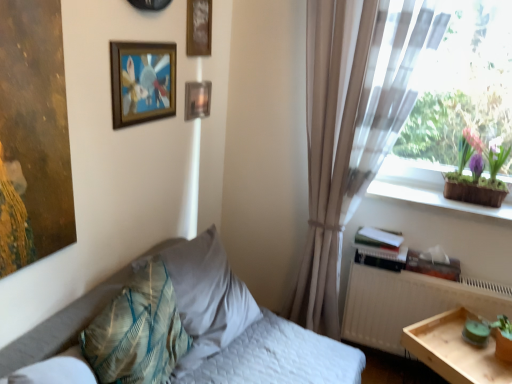
What do you see at coordinates (197, 99) in the screenshot?
I see `metallic rectangular frame at upper center, the first picture frame viewed from the back` at bounding box center [197, 99].

The image size is (512, 384). What do you see at coordinates (454, 350) in the screenshot?
I see `light wood tray at lower right` at bounding box center [454, 350].

Identify the location of wooden frame at upper left, which ranks as the first picture frame in front-to-back order. (142, 82).

What are the coordinates of `green wood window sill at upper right` in the screenshot? It's located at (435, 199).

What do you see at coordinates (199, 27) in the screenshot? The height and width of the screenshot is (384, 512). I see `wooden picture frame at upper center, which appears as the 2th picture frame when viewed from the back` at bounding box center [199, 27].

In order to face textured teal pillow at lower left, positioned as the 1th pillow in front-to-back order, should I rotate leftwards or rightwards?

Turn left by 14.832 degrees to look at textured teal pillow at lower left, positioned as the 1th pillow in front-to-back order.

Find the location of a particular element. metallic rectangular frame at upper center, the first picture frame viewed from the back is located at coordinates (197, 99).

Does textured beige pillow at center-left, arranged as the second pillow when viewed from the front, touch purple clay pot at window?

No.

Is purple clay pot at window at the back of textured beige pillow at center-left, the 1th pillow when ordered from back to front?

No, purple clay pot at window is not at the back of textured beige pillow at center-left, the 1th pillow when ordered from back to front.

From the image's perspective, is textured beige pillow at center-left, arranged as the second pillow when viewed from the front, positioned above or below purple clay pot at window?

Clearly, from the image's perspective, textured beige pillow at center-left, arranged as the second pillow when viewed from the front, is below purple clay pot at window.

Is light wood tray at lower right wider or thinner than textured beige pillow at center-left, the 1th pillow when ordered from back to front?

Clearly, light wood tray at lower right has less width compared to textured beige pillow at center-left, the 1th pillow when ordered from back to front.

From a real-world perspective, is light wood tray at lower right below textured beige pillow at center-left, the 1th pillow when ordered from back to front?

Correct, in the physical world, light wood tray at lower right is lower than textured beige pillow at center-left, the 1th pillow when ordered from back to front.

Who is bigger, light wood tray at lower right or textured beige pillow at center-left, the 1th pillow when ordered from back to front?

light wood tray at lower right.

Which of these two, light wood tray at lower right or textured beige pillow at center-left, the 1th pillow when ordered from back to front, stands taller?

With more height is light wood tray at lower right.

Does purple clay pot at window turn towards textured beige pillow at center-left, arranged as the second pillow when viewed from the front?

No, purple clay pot at window does not turn towards textured beige pillow at center-left, arranged as the second pillow when viewed from the front.

Identify the location of houseplant above the textured beige pillow at center-left, the 1th pillow when ordered from back to front (from the image's perspective). (477, 173).

Can you confirm if purple clay pot at window is bigger than textured beige pillow at center-left, the 1th pillow when ordered from back to front?

No, purple clay pot at window is not bigger than textured beige pillow at center-left, the 1th pillow when ordered from back to front.

Looking at this image, from the image's perspective, is purple clay pot at window located above textured beige pillow at center-left, the 1th pillow when ordered from back to front?

Yes, from the image's perspective, purple clay pot at window is on top of textured beige pillow at center-left, the 1th pillow when ordered from back to front.

Is translucent fabric at upper right in front of metallic rectangular frame at upper center, placed as the third picture frame when sorted from front to back?

Yes, it is in front of metallic rectangular frame at upper center, placed as the third picture frame when sorted from front to back.

From the translucent fabric at upper right, count 2nd picture frames backward and point to it. Please provide its 2D coordinates.

[(197, 99)]

In the scene shown: Between translucent fabric at upper right and metallic rectangular frame at upper center, the first picture frame viewed from the back, which one has smaller width?

metallic rectangular frame at upper center, the first picture frame viewed from the back, is thinner.

How many degrees apart are the facing directions of translucent fabric at upper right and metallic rectangular frame at upper center, placed as the third picture frame when sorted from front to back?

The angle between the facing direction of translucent fabric at upper right and the facing direction of metallic rectangular frame at upper center, placed as the third picture frame when sorted from front to back, is 90 degrees.

Visually, is light wood tray at lower right positioned to the left or to the right of translucent fabric at upper right?

Clearly, light wood tray at lower right is on the left of translucent fabric at upper right in the image.

In the scene shown: Is light wood tray at lower right outside of translucent fabric at upper right?

Yes, light wood tray at lower right is not within translucent fabric at upper right.

From the image's perspective, which one is positioned lower, light wood tray at lower right or translucent fabric at upper right?

light wood tray at lower right, from the image's perspective.

Which object is thinner, green wood window sill at upper right or metallic rectangular frame at upper center, placed as the third picture frame when sorted from front to back?

metallic rectangular frame at upper center, placed as the third picture frame when sorted from front to back.

Is point (412, 194) positioned in front of point (199, 94)?

No, it is not.

From the image's perspective, between green wood window sill at upper right and metallic rectangular frame at upper center, placed as the third picture frame when sorted from front to back, which one is located above?

metallic rectangular frame at upper center, placed as the third picture frame when sorted from front to back, appears higher in the image.

Based on their positions, is green wood window sill at upper right located to the left or right of metallic rectangular frame at upper center, placed as the third picture frame when sorted from front to back?

In the image, green wood window sill at upper right appears on the right side of metallic rectangular frame at upper center, placed as the third picture frame when sorted from front to back.

Is metallic rectangular frame at upper center, the first picture frame viewed from the back, outside of white matte radiator at right?

Indeed, metallic rectangular frame at upper center, the first picture frame viewed from the back, is completely outside white matte radiator at right.

Which of these two, metallic rectangular frame at upper center, placed as the third picture frame when sorted from front to back, or white matte radiator at right, stands taller?

Standing taller between the two is white matte radiator at right.

In the scene shown: Is there a large distance between metallic rectangular frame at upper center, placed as the third picture frame when sorted from front to back, and white matte radiator at right?

Indeed, metallic rectangular frame at upper center, placed as the third picture frame when sorted from front to back, is not near white matte radiator at right.

Is metallic rectangular frame at upper center, placed as the third picture frame when sorted from front to back, in front of or behind white matte radiator at right in the image?

Clearly, metallic rectangular frame at upper center, placed as the third picture frame when sorted from front to back, is behind white matte radiator at right.

The width and height of the screenshot is (512, 384). In order to click on the 1st pillow in front of the purple clay pot at window, starting your count from the anchor in this screenshot , I will do `click(207, 297)`.

Where is `table below the textured beige pillow at center-left, the 1th pillow when ordered from back to front (from the image's perspective)`? The height and width of the screenshot is (384, 512). table below the textured beige pillow at center-left, the 1th pillow when ordered from back to front (from the image's perspective) is located at coordinates (454, 350).

Estimate the real-world distances between objects in this image. Which object is further from white quilted bed at lower left, textured teal pillow at lower left, the 2th pillow in the back-to-front sequence, or metallic rectangular frame at upper center, placed as the third picture frame when sorted from front to back?

Among the two, metallic rectangular frame at upper center, placed as the third picture frame when sorted from front to back, is located further to white quilted bed at lower left.

Considering their positions, is wooden picture frame at upper center, arranged as the second picture frame when viewed from the front, positioned closer to translucent fabric at upper right than textured teal pillow at lower left, the 2th pillow in the back-to-front sequence?

wooden picture frame at upper center, arranged as the second picture frame when viewed from the front, lies closer to translucent fabric at upper right than the other object.

From the image, which object appears to be nearer to white quilted bed at lower left, wooden picture frame at upper center, which appears as the 2th picture frame when viewed from the back, or textured teal pillow at lower left, positioned as the 1th pillow in front-to-back order?

Based on the image, textured teal pillow at lower left, positioned as the 1th pillow in front-to-back order, appears to be nearer to white quilted bed at lower left.

Estimate the real-world distances between objects in this image. Which object is further from white quilted bed at lower left, beige sheer curtain at right or white matte radiator at right?

Based on the image, beige sheer curtain at right appears to be further to white quilted bed at lower left.

Looking at the image, which one is located further to green wood window sill at upper right, white matte radiator at right or translucent fabric at upper right?

Among the two, translucent fabric at upper right is located further to green wood window sill at upper right.

Considering their positions, is purple clay pot at window positioned closer to textured teal pillow at lower left, the 2th pillow in the back-to-front sequence, than white matte radiator at right?

white matte radiator at right is closer to textured teal pillow at lower left, the 2th pillow in the back-to-front sequence.

Estimate the real-world distances between objects in this image. Which object is closer to metallic rectangular frame at upper center, placed as the third picture frame when sorted from front to back, white quilted bed at lower left or light wood tray at lower right?

white quilted bed at lower left is positioned closer to the anchor metallic rectangular frame at upper center, placed as the third picture frame when sorted from front to back.

From the image, which object appears to be farther from beige sheer curtain at right, white matte radiator at right or light wood tray at lower right?

light wood tray at lower right is positioned further to the anchor beige sheer curtain at right.

Where is `pillow between wooden frame at upper left, which is the third picture frame from back to front, and textured teal pillow at lower left, positioned as the 1th pillow in front-to-back order, in the up-down direction`? The height and width of the screenshot is (384, 512). pillow between wooden frame at upper left, which is the third picture frame from back to front, and textured teal pillow at lower left, positioned as the 1th pillow in front-to-back order, in the up-down direction is located at coordinates (207, 297).

I want to click on table located between wooden frame at upper left, which is the third picture frame from back to front, and translucent fabric at upper right in the left-right direction, so click(454, 350).

Identify the location of curtain located between wooden frame at upper left, which ranks as the first picture frame in front-to-back order, and green wood window sill at upper right in the left-right direction. (353, 124).

You are a GUI agent. You are given a task and a screenshot of the screen. Output one action in this format:
    pyautogui.click(x=<x>, y=<y>)
    Task: Click on the bed between translucent fabric at upper right and light wood tray at lower right vertically
    
    Given the screenshot: What is the action you would take?
    pyautogui.click(x=229, y=325)